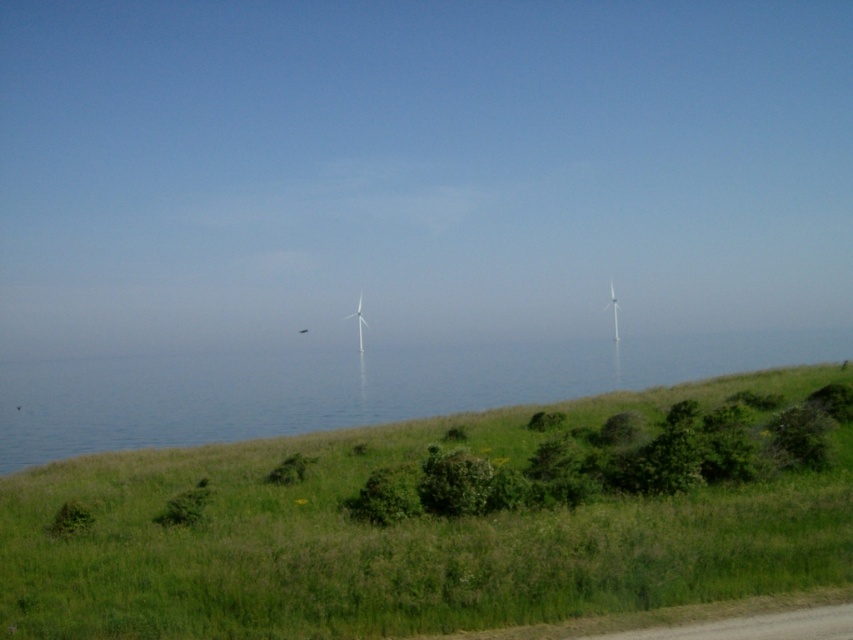
You are standing at the top of the green grassy hillside at lower center and want to walk down to the blue water at center. Considering the width of the hillside compared to the water, which direction should you head towards to reach the water most efficiently?

The green grassy hillside at lower center has a lesser width compared to the blue water at center, so you should head towards the direction where the blue water at center is wider to reach it most efficiently.

You are a photographer planning to capture the entire scene of the blue water at center and the white matte wind turbine at center in one shot. Based on their sizes, which object will occupy more of the frame?

The blue water at center is larger in size than the white matte wind turbine at center, so it will occupy more of the frame.

You are standing on the grassy hill and want to take a photo of both the blue water at center and the white matte wind turbine at center. Which object should you zoom in on first to ensure both are in focus?

You should zoom in on the white matte wind turbine at center first because it is farther away from the viewer than the blue water at center, so adjusting focus starting from the distant object ensures both are in focus.